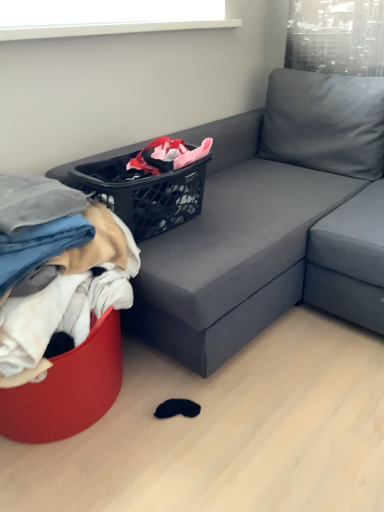
Question: Is the position of black plastic basket at upper center less distant than that of denim fabric pants at lower left, which appears as the first clothing when viewed from the top?

Choices:
 (A) yes
 (B) no

Answer: (B)

Question: Is black plastic basket at upper center at the left side of denim fabric pants at lower left, which appears as the first clothing when viewed from the top?

Choices:
 (A) yes
 (B) no

Answer: (B)

Question: Is black plastic basket at upper center placed right next to denim fabric pants at lower left, the 2th clothing when ordered from bottom to top?

Choices:
 (A) yes
 (B) no

Answer: (B)

Question: Is black plastic basket at upper center looking in the opposite direction of denim fabric pants at lower left, the 2th clothing when ordered from bottom to top?

Choices:
 (A) no
 (B) yes

Answer: (A)

Question: From a real-world perspective, is black plastic basket at upper center physically above denim fabric pants at lower left, the 2th clothing when ordered from bottom to top?

Choices:
 (A) yes
 (B) no

Answer: (A)

Question: In terms of height, does matte gray couch at center look taller or shorter compared to soft cotton clothes at left, marked as the 1th clothing in a bottom-to-top arrangement?

Choices:
 (A) tall
 (B) short

Answer: (A)

Question: From the image's perspective, is matte gray couch at center positioned above or below soft cotton clothes at left, marked as the 1th clothing in a bottom-to-top arrangement?

Choices:
 (A) below
 (B) above

Answer: (B)

Question: Is matte gray couch at center wider or thinner than soft cotton clothes at left, arranged as the second clothing when viewed from the top?

Choices:
 (A) wide
 (B) thin

Answer: (A)

Question: From a real-world perspective, is matte gray couch at center above or below soft cotton clothes at left, marked as the 1th clothing in a bottom-to-top arrangement?

Choices:
 (A) below
 (B) above

Answer: (A)

Question: Considering the positions of denim fabric pants at lower left, the 2th clothing when ordered from bottom to top, and black plastic basket at upper center in the image, is denim fabric pants at lower left, the 2th clothing when ordered from bottom to top, wider or thinner than black plastic basket at upper center?

Choices:
 (A) wide
 (B) thin

Answer: (A)

Question: Is point (69, 216) closer or farther from the camera than point (145, 218)?

Choices:
 (A) closer
 (B) farther

Answer: (A)

Question: From their relative heights in the image, would you say denim fabric pants at lower left, the 2th clothing when ordered from bottom to top, is taller or shorter than black plastic basket at upper center?

Choices:
 (A) tall
 (B) short

Answer: (B)

Question: From the image's perspective, is denim fabric pants at lower left, which appears as the first clothing when viewed from the top, located above or below black plastic basket at upper center?

Choices:
 (A) above
 (B) below

Answer: (B)

Question: From a real-world perspective, is soft cotton clothes at left, arranged as the second clothing when viewed from the top, physically located above or below black plastic basket at upper center?

Choices:
 (A) below
 (B) above

Answer: (A)

Question: Do you think soft cotton clothes at left, marked as the 1th clothing in a bottom-to-top arrangement, is within black plastic basket at upper center, or outside of it?

Choices:
 (A) outside
 (B) inside

Answer: (A)